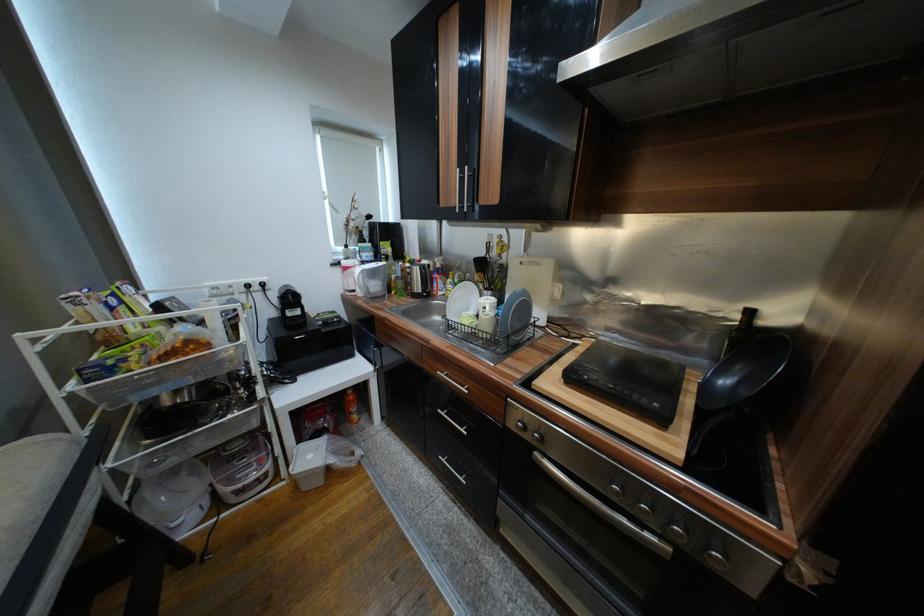
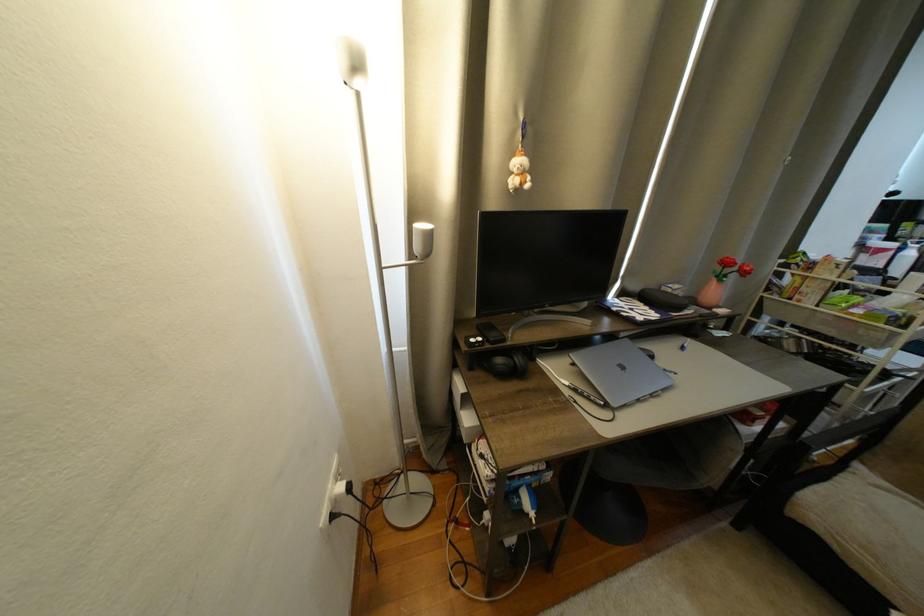
Which direction would the cameraman need to move to produce the second image?

The cameraman moved toward left, backward.